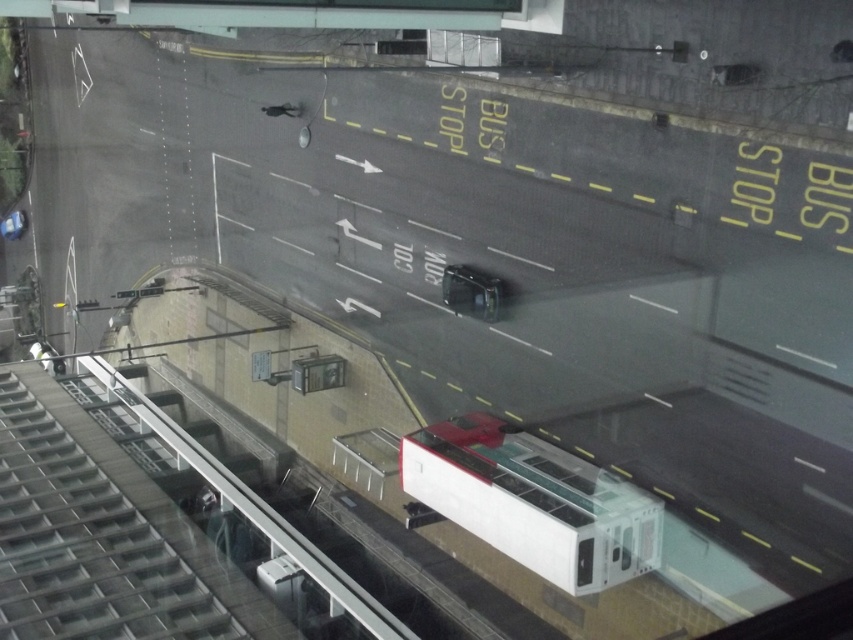
You are standing at the corner of the street and want to place a white plastic train at center. According to the image, where exactly should you place it?

You should place the white plastic train at center at point (532, 500) as per the coordinates provided.

You are a delivery person trying to navigate through the street. You see a white plastic train at center and a shiny silver car at center. Which vehicle should you avoid if you need to pass through the narrower path?

The shiny silver car at center is narrower than the white plastic train at center, so you should avoid the white plastic train at center to pass through the narrower path.